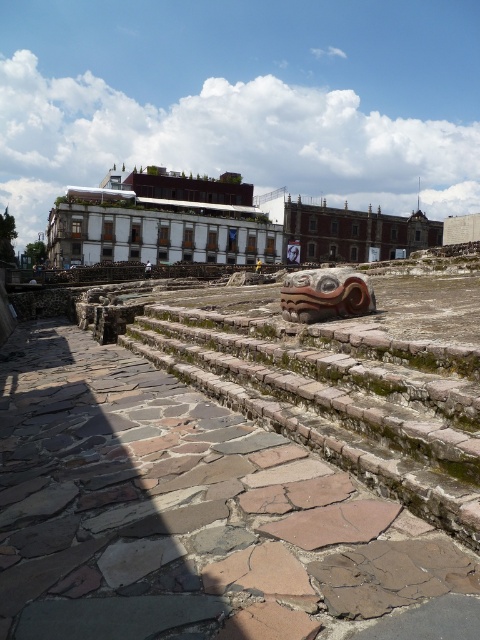
Question: Which of the following is the farthest from the observer?

Choices:
 (A) rustic stone stairs at center
 (B) white stone amphitheater at center

Answer: (B)

Question: Does rustic stone stairs at center have a greater width compared to white stone amphitheater at center?

Choices:
 (A) no
 (B) yes

Answer: (A)

Question: Where is rustic stone stairs at center located in relation to white stone amphitheater at center in the image?

Choices:
 (A) left
 (B) right

Answer: (A)

Question: Does rustic stone stairs at center have a greater width compared to white stone amphitheater at center?

Choices:
 (A) yes
 (B) no

Answer: (B)

Question: Which point is closer to the camera?

Choices:
 (A) rustic stone stairs at center
 (B) white stone amphitheater at center

Answer: (A)

Question: Which point appears closest to the camera in this image?

Choices:
 (A) (419, 438)
 (B) (104, 211)

Answer: (A)